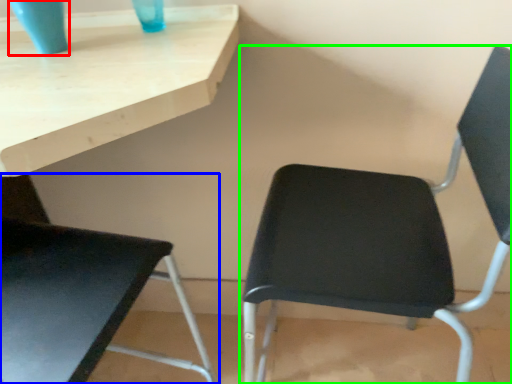
Question: Which object is the closest to the glass vase (highlighted by a red box)? Choose among these: chair (highlighted by a blue box) or chair (highlighted by a green box).

Choices:
 (A) chair
 (B) chair

Answer: (A)